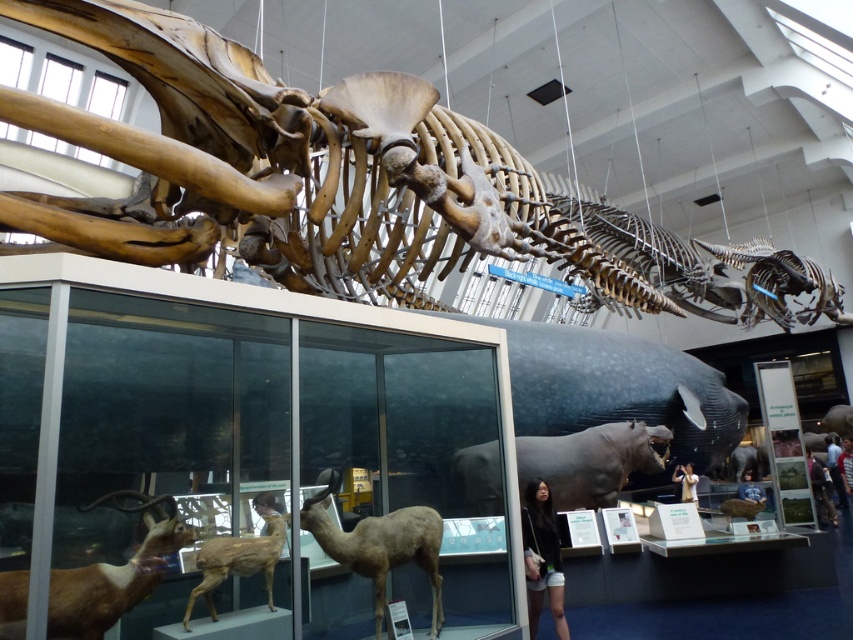
Based on the photo, you are a museum visitor standing in front of the glass display case. You notice the brown matte hippo at center and the matte black hair at center. Which object is shorter?

The brown matte hippo at center is shorter than the matte black hair at center.

You are standing in the museum and want to take a photo of both the whale skeleton and the glass display case. You notice two points marked on the floor at coordinates point (x=599, y=426) and point (x=51, y=630). Which point should you stand at to ensure both the whale skeleton and the glass display case are in your camera frame?

You should stand at point (x=599, y=426) because it is closer to you than point (x=51, y=630), allowing you to capture both the whale skeleton above and the glass display case below in your camera frame.